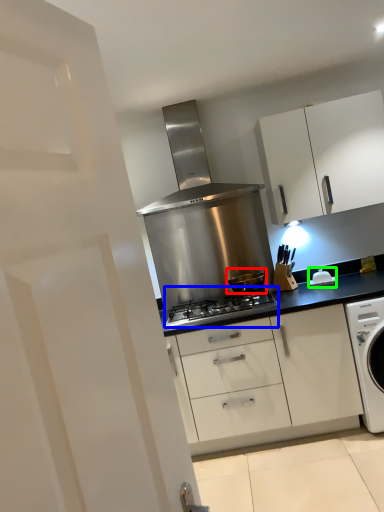
Question: Which object is positioned closest to kitchen appliance (highlighted by a red box)? Select from gas stove (highlighted by a blue box) and appliance (highlighted by a green box).

Choices:
 (A) gas stove
 (B) appliance

Answer: (A)